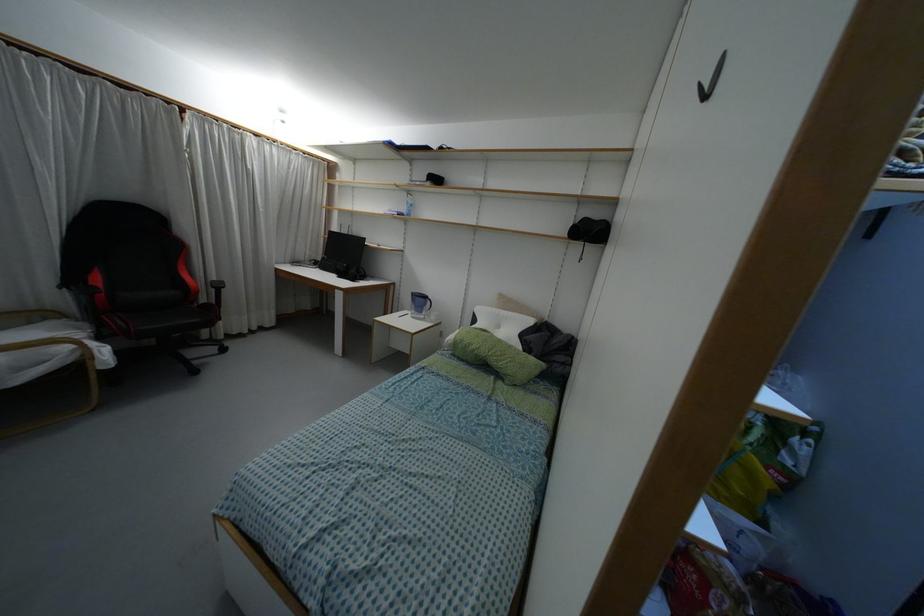
What do you see at coordinates (149, 300) in the screenshot? The image size is (924, 616). I see `a black chair sitting surface` at bounding box center [149, 300].